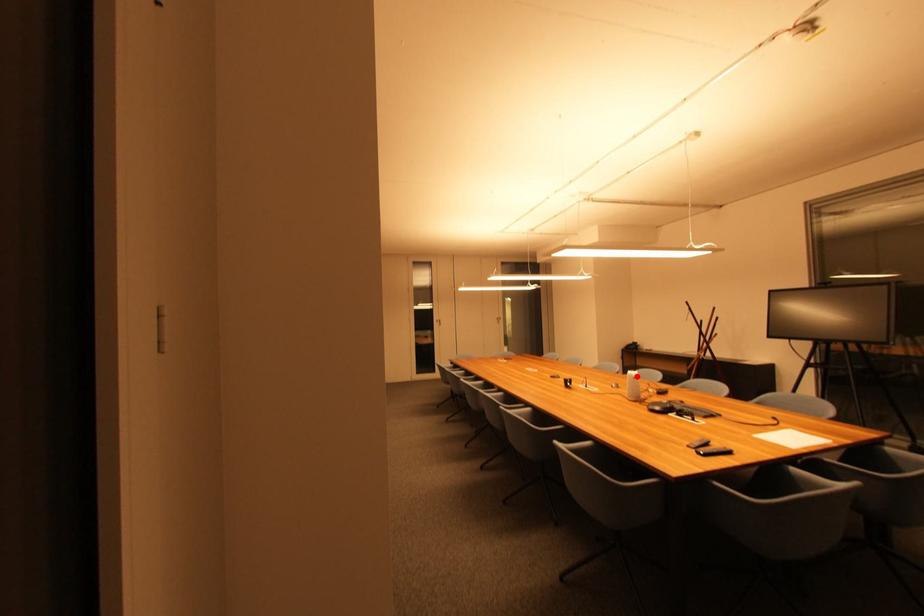
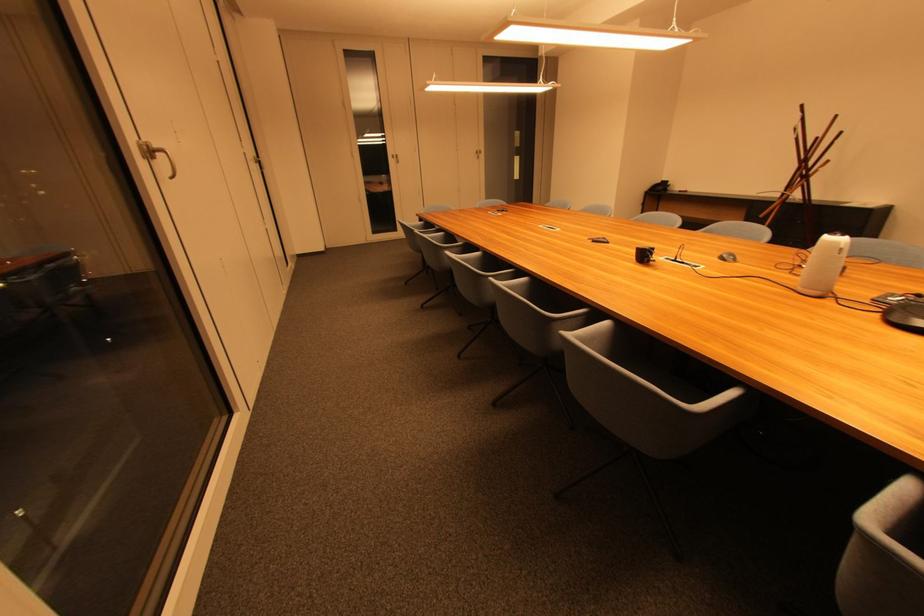
Question: I am providing you with two images of the same scene from different viewpoints. A red point is shown in image1. For the corresponding object point in image2, is it positioned nearer or farther from the camera?

Choices:
 (A) Nearer
 (B) Farther

Answer: (A)